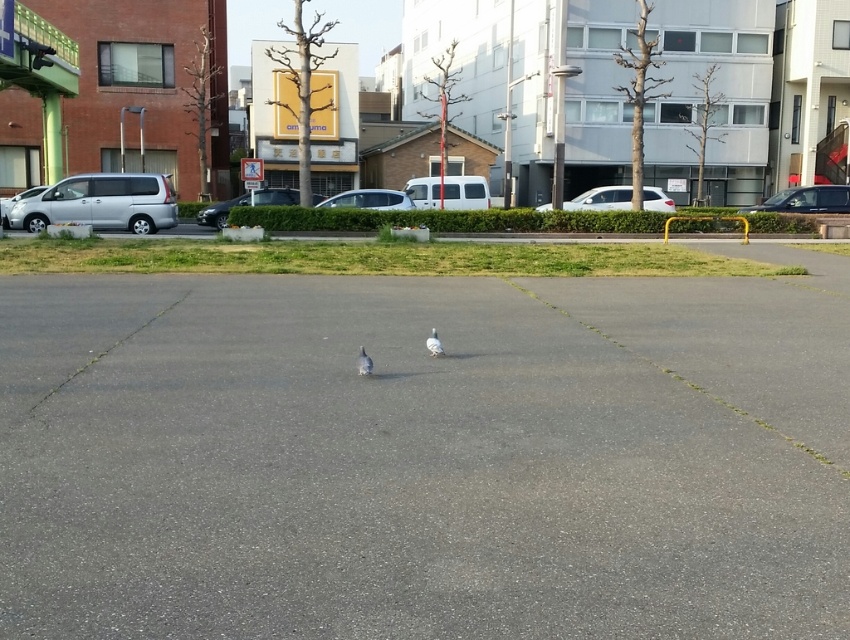
Question: Is gray asphalt parking lot at center in front of dark gray metallic car at right?

Choices:
 (A) no
 (B) yes

Answer: (B)

Question: Is white matte car at center in front of satin white sedan at center?

Choices:
 (A) no
 (B) yes

Answer: (A)

Question: Which object appears farthest from the camera in this image?

Choices:
 (A) white matte car at center
 (B) silver metallic car at center

Answer: (A)

Question: Observing the image, what is the correct spatial positioning of white matte car at center in reference to silver metallic car at center?

Choices:
 (A) right
 (B) left

Answer: (A)

Question: Which object is positioned farthest from the silver metallic van at left?

Choices:
 (A) white matte pigeon at center
 (B) white matte car at center
 (C) silver metallic car at center

Answer: (A)

Question: Which point is farther to the camera?

Choices:
 (A) (92, 515)
 (B) (800, 209)

Answer: (B)